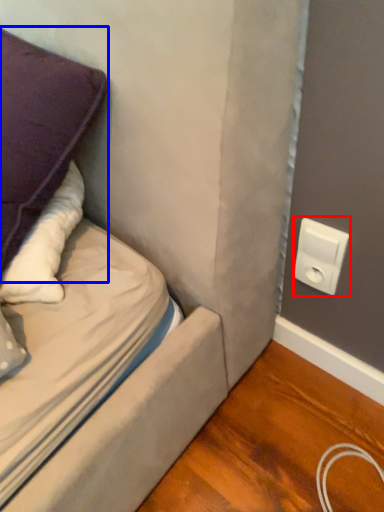
Question: Among these objects, which one is farthest to the camera, electric outlet (highlighted by a red box) or pillow (highlighted by a blue box)?

Choices:
 (A) electric outlet
 (B) pillow

Answer: (A)